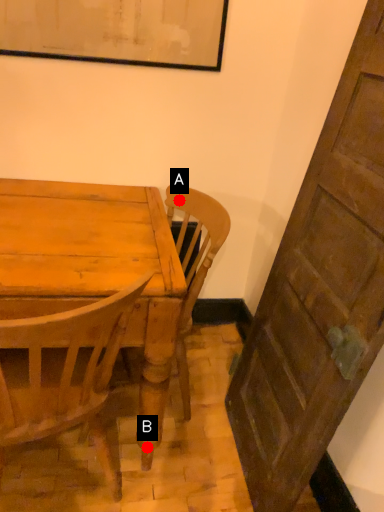
Question: Two points are circled on the image, labeled by A and B beside each circle. Which point is farther from the camera taking this photo?

Choices:
 (A) A is further
 (B) B is further

Answer: (A)